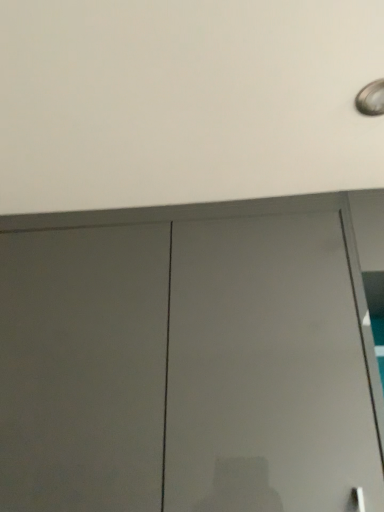
The width and height of the screenshot is (384, 512). What do you see at coordinates (188, 361) in the screenshot? I see `matte gray door at center` at bounding box center [188, 361].

Image resolution: width=384 pixels, height=512 pixels. In order to click on matte gray door at center in this screenshot , I will do `click(188, 361)`.

Measure the distance between matte gray door at center and camera.

matte gray door at center and camera are 29.00 inches apart.

What is the approximate height of matte gray door at center?

It is 28.42 inches.

This screenshot has width=384, height=512. Find the location of `matte gray door at center`. matte gray door at center is located at coordinates (188, 361).